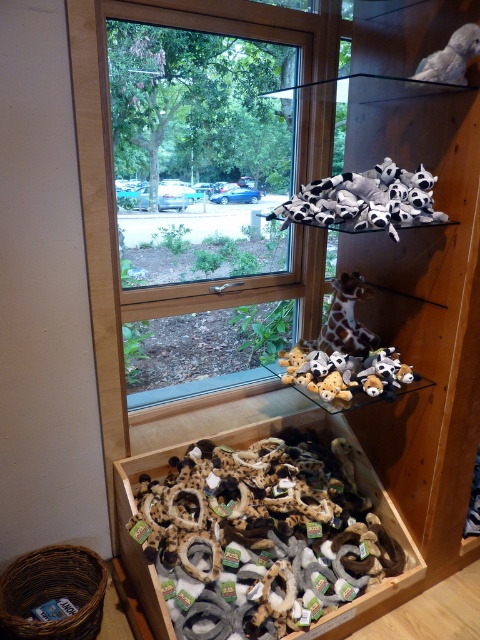
Does point (261, 310) come farther from viewer compared to point (224, 580)?

That is True.

Can you confirm if clear glass window at upper center is taller than soft plush toys at lower center?

Yes, clear glass window at upper center is taller than soft plush toys at lower center.

Measure the distance between point [280,118] and camera.

They are 2.25 meters apart.

Locate an element on the screen. Image resolution: width=480 pixels, height=640 pixels. clear glass window at upper center is located at coordinates (201, 198).

Who is more distant from viewer, (177, 614) or (445, 61)?

The point (177, 614) is more distant.

Between soft plush toys at lower center and white plush toy at upper right, which one appears on the right side from the viewer's perspective?

white plush toy at upper right is more to the right.

Which is in front, point (307, 596) or point (464, 26)?

Positioned in front is point (464, 26).

Identify the location of soft plush toys at lower center. (260, 536).

Can you confirm if clear glass window at upper center is positioned above white plush toy at upper right?

Actually, clear glass window at upper center is below white plush toy at upper right.

Does clear glass window at upper center have a larger size compared to white plush toy at upper right?

Correct, clear glass window at upper center is larger in size than white plush toy at upper right.

Is point (160, 376) behind point (431, 60)?

Yes, it is.

At what (x,y) coordinates should I click in order to perform the action: click on clear glass window at upper center. Please return your answer as a coordinate pair (x, y). Looking at the image, I should click on (201, 198).